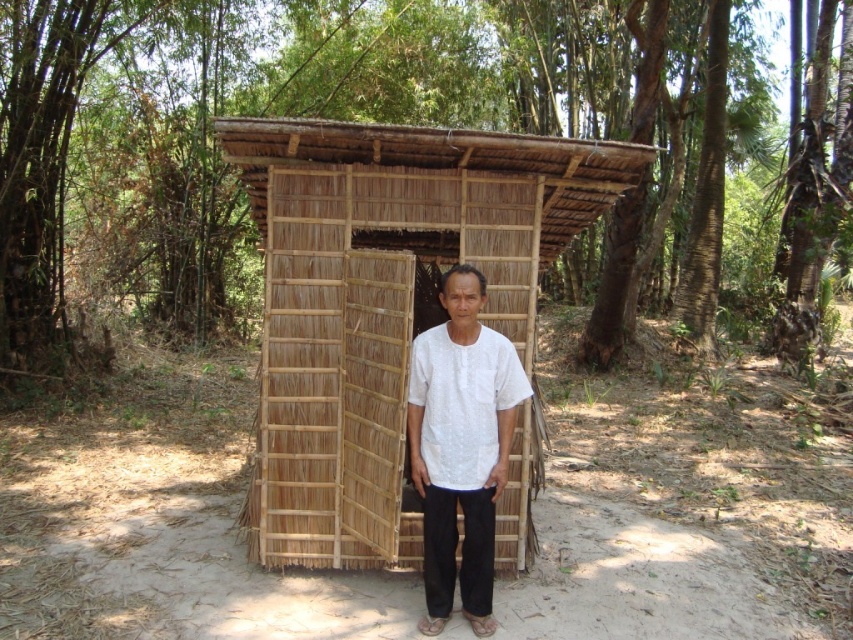
You are standing 10 feet away from the bamboo mat hut at center. Can you step into it without moving closer?

The bamboo mat hut at center is 12.02 feet away from the viewer. Since you are only 10 feet away, you are closer than the actual distance, so you can step into it without moving closer.

You are a photographer trying to capture a photo of the white cotton shirt at center inside the bamboo structure. Since the natural brown bamboo forest at center is in the background, will the forest appear wider than the shirt in the photo?

The natural brown bamboo forest at center is wider than the white cotton shirt at center, so yes, the forest will appear wider than the shirt in the photo.